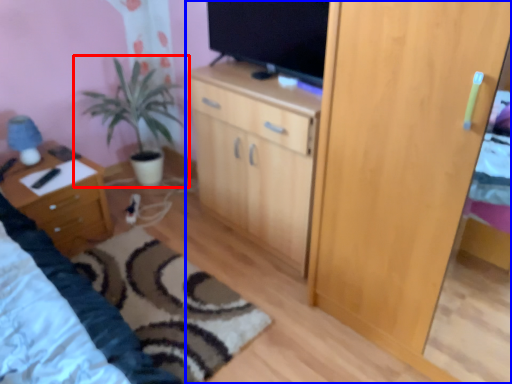
Question: Which object appears farthest to the camera in this image, houseplant (highlighted by a red box) or cupboard (highlighted by a blue box)?

Choices:
 (A) houseplant
 (B) cupboard

Answer: (A)